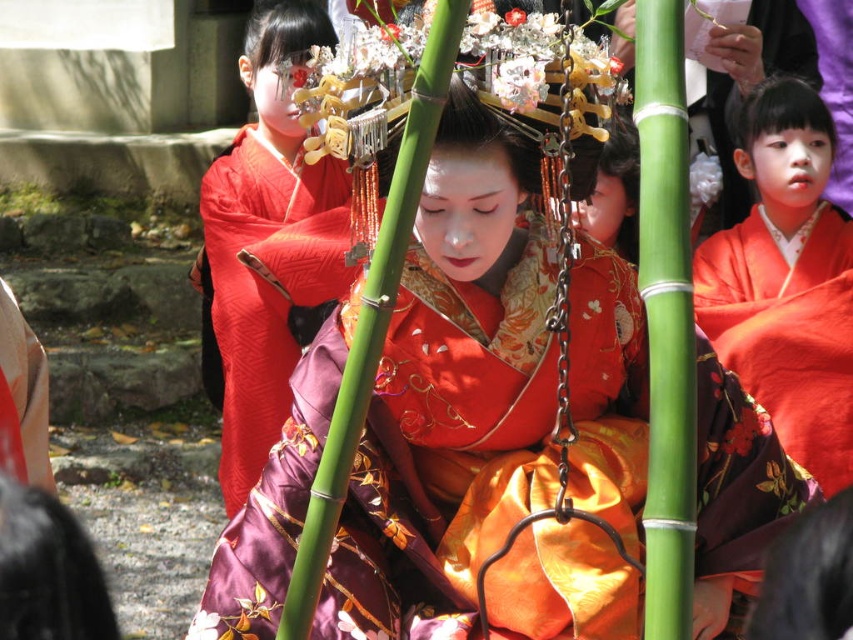
You are a photographer at the festival and want to capture both the satin kimono at center and the silky red kimono at center in a single frame. Which kimono should you focus on first to ensure both are in the shot?

The silky red kimono at center is to the left of the satin kimono at center, so focusing on the silky red kimono at center first would allow you to frame both kimono in the shot.

You are standing in front of the scene and want to determine which of the two points, point (281, 20) or point (763, 385), is closer to you. Based on the description, which point is nearer?

Point (281, 20) is further to the viewer than point (763, 385). Wait, no, the description says the first point is further to the viewer than the second. So the closer point would be the second one. Hmm, need to clarify. The question asks which is closer to you. Since point A is further away than point B, then point B is closer. So the answer is point (763, 385) is closer.

You are a tailor who needs to determine which kimono requires more fabric to make between the silky red kimono at center and the silky orange kimono at right. Based on the scene, which one would need more fabric?

The silky red kimono at center requires more fabric because its width is larger than the silky orange kimono at right.